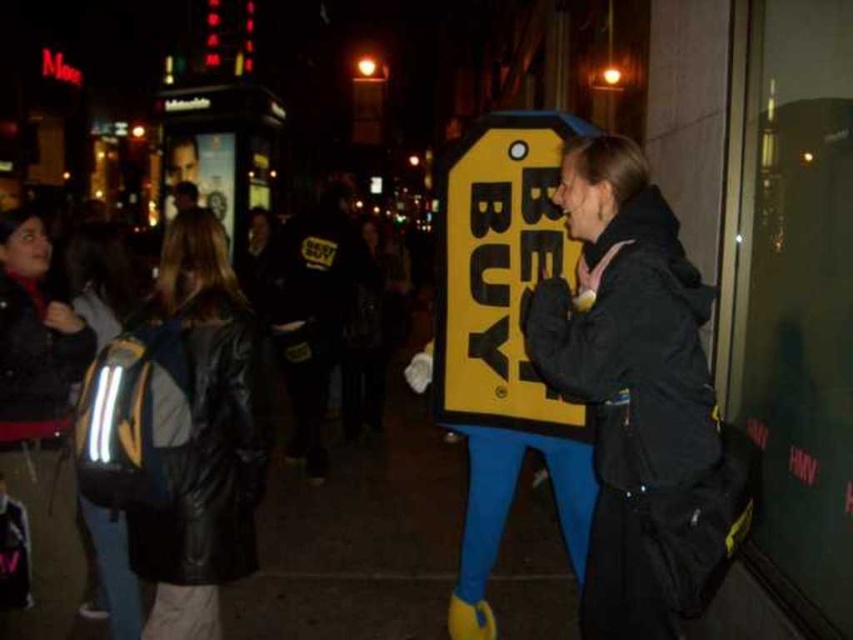
Question: Is black matte jacket at center to the right of black leather jacket at upper left from the viewer's perspective?

Choices:
 (A) no
 (B) yes

Answer: (B)

Question: Does black matte jacket at center have a greater width compared to yellow cardboard sign at center?

Choices:
 (A) no
 (B) yes

Answer: (A)

Question: Does black matte jacket at center appear over yellow cardboard sign at center?

Choices:
 (A) yes
 (B) no

Answer: (B)

Question: Which point is closer to the camera taking this photo?

Choices:
 (A) (485, 282)
 (B) (18, 237)

Answer: (B)

Question: Which object appears farthest from the camera in this image?

Choices:
 (A) black leather jacket at center
 (B) black leather jacket at upper left
 (C) yellow cardboard sign at center

Answer: (C)

Question: Which of the following is the farthest from the observer?

Choices:
 (A) 33,355
 (B) 228,316
 (C) 518,282

Answer: (C)